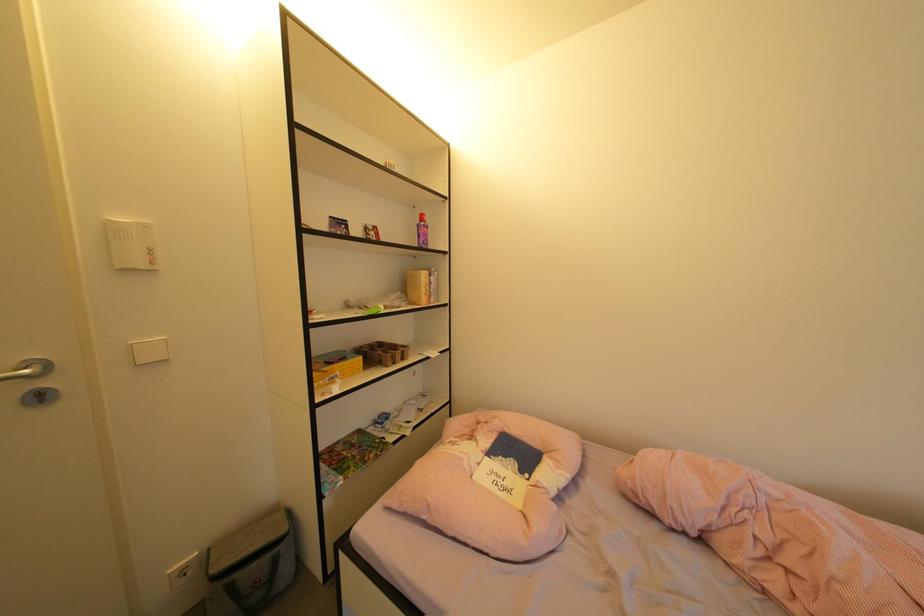
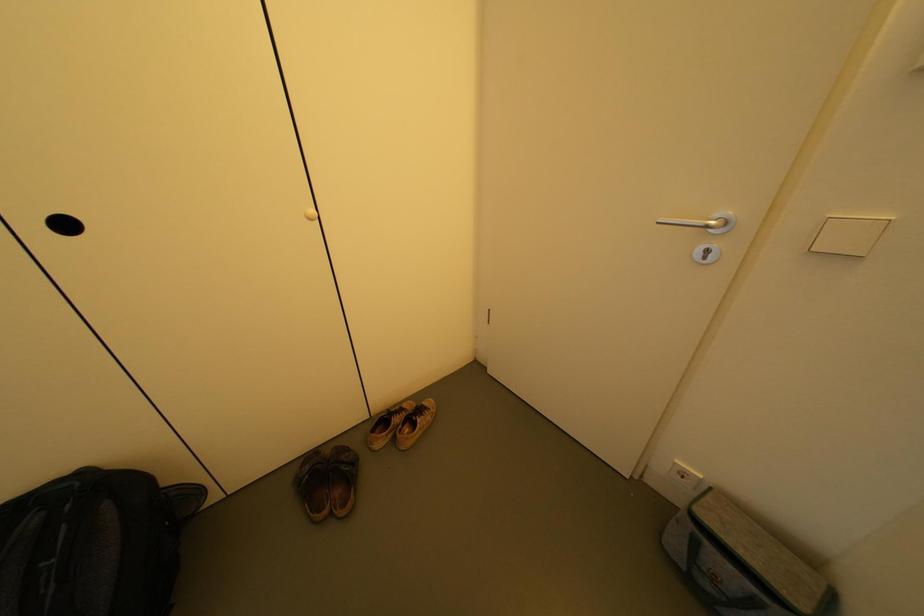
First-person continuous shooting, in which direction is the camera rotating?

The camera's rotation is toward left-down.